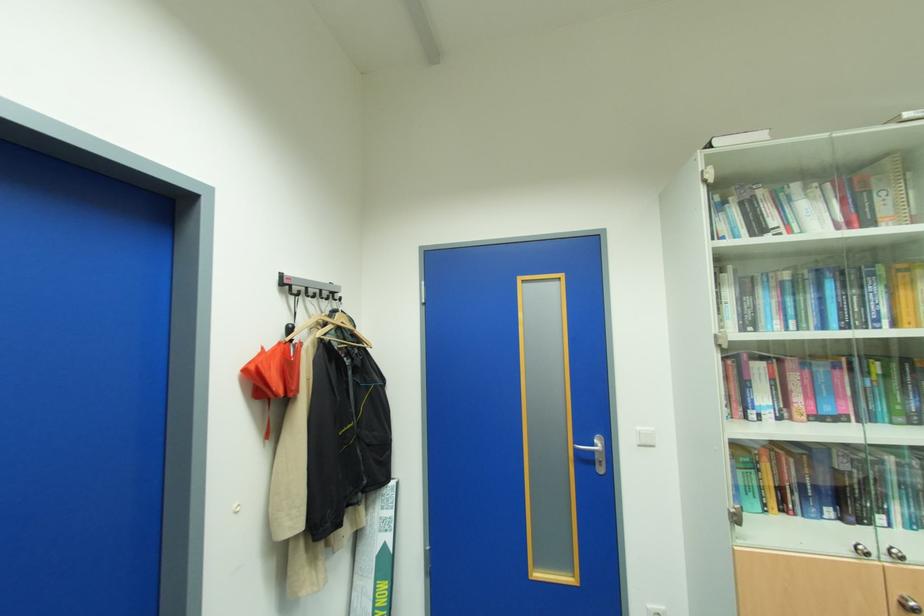
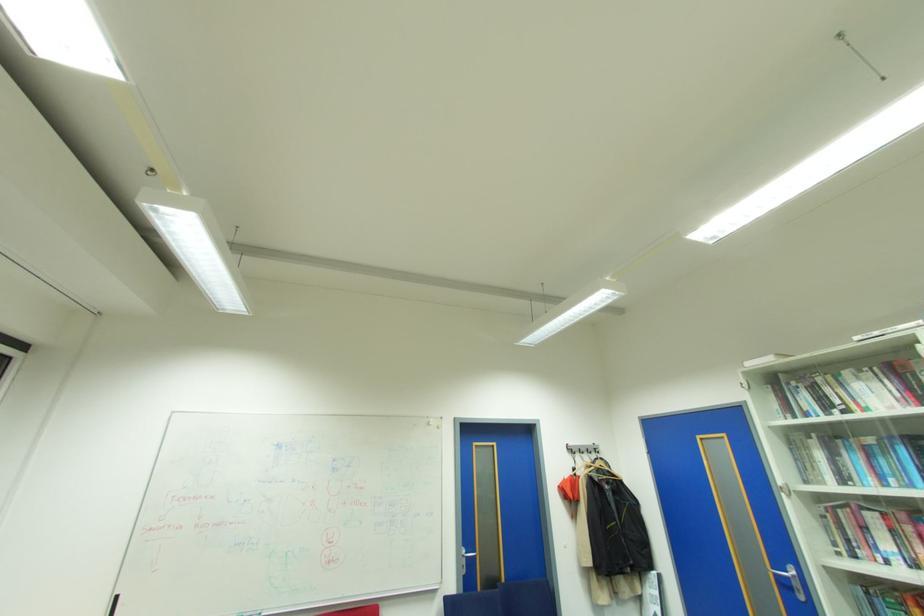
Find the pixel in the second image that matches the point at 288,282 in the first image.

(573, 448)